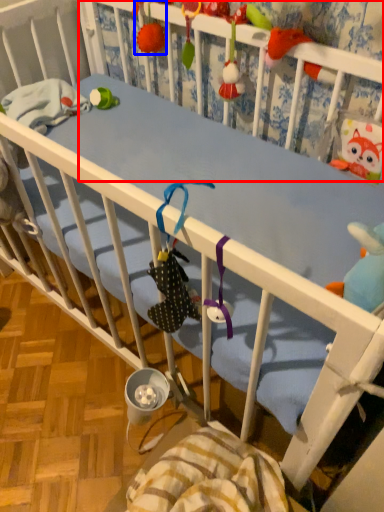
Question: Among these objects, which one is nearest to the camera, infant bed (highlighted by a red box) or toy (highlighted by a blue box)?

Choices:
 (A) infant bed
 (B) toy

Answer: (A)